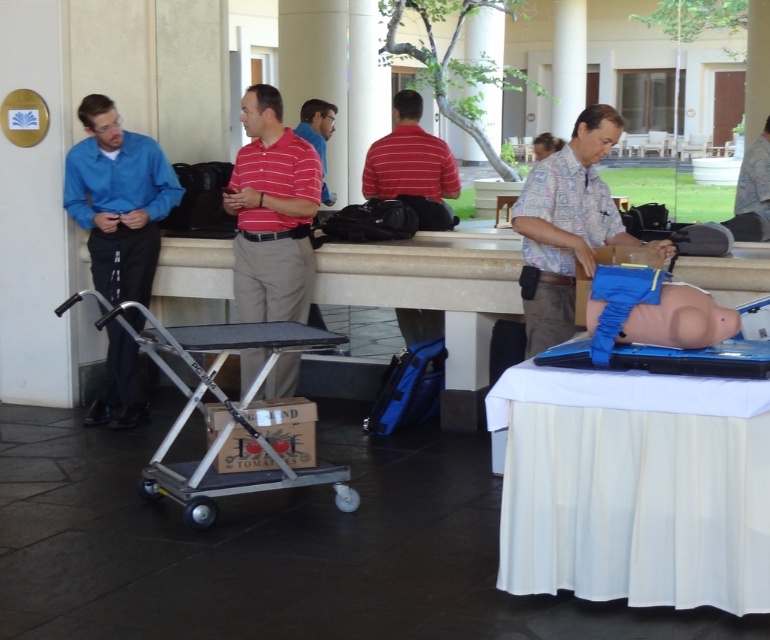
You are organizing a medical training event and need to place the striped cotton shirt at center and the silver metallic cart at center on a shelf. The shelf has limited space. Which object should you place first to ensure both fit?

The striped cotton shirt at center is smaller than the silver metallic cart at center, so you should place the silver metallic cart at center first to accommodate its larger size before placing the striped cotton shirt at center.

You are a nurse who needs to retrieve the blue matte shirt at left and the silver metallic cart at center. Which object should you approach first if you want to pick up the one closer to your current position?

The blue matte shirt at left is to the left of the silver metallic cart at center, so if you are standing in front of the cart, the shirt is closer and should be approached first.